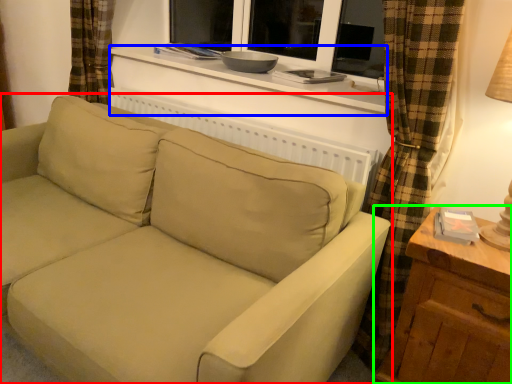
Question: Which object is positioned farthest from studio couch (highlighted by a red box)? Select from window sill (highlighted by a blue box) and table (highlighted by a green box).

Choices:
 (A) window sill
 (B) table

Answer: (A)